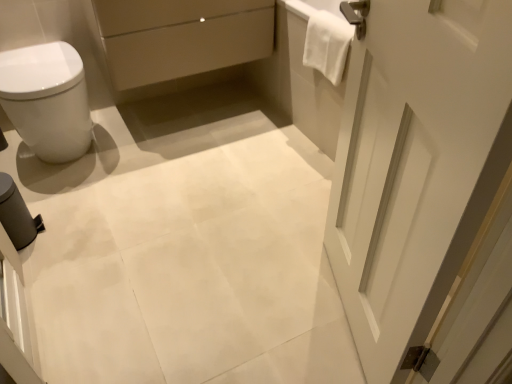
Measure the distance between point (392, 227) and camera.

36.69 inches.

Where is `matte beige drawer at upper center`? The height and width of the screenshot is (384, 512). matte beige drawer at upper center is located at coordinates (181, 37).

You are a GUI agent. You are given a task and a screenshot of the screen. Output one action in this format:
    pyautogui.click(x=<x>, y=<y>)
    Task: Click on the white matte door at right
    
    Given the screenshot: What is the action you would take?
    pyautogui.click(x=416, y=165)

From the image's perspective, would you say white towel at upper right is positioned over white glossy bidet at left?

Yes.

Considering the positions of points (330, 28) and (62, 113), is point (330, 28) farther from camera compared to point (62, 113)?

No, (330, 28) is closer to viewer.

Looking at this image, from the image's perspective, does matte beige drawer at upper center appear higher than white towel at upper right?

Yes.

Could you tell me if matte beige drawer at upper center is turned towards white towel at upper right?

Yes, matte beige drawer at upper center is oriented towards white towel at upper right.

Does point (258, 26) come behind point (337, 65)?

Yes, point (258, 26) is farther from viewer.

From a real-world perspective, between matte beige drawer at upper center and white towel at upper right, who is vertically lower?

matte beige drawer at upper center, from a real-world perspective.

Is matte beige drawer at upper center completely or partially inside white glossy bidet at left?

No, white glossy bidet at left does not contain matte beige drawer at upper center.

Visually, is white glossy bidet at left positioned to the left or to the right of matte beige drawer at upper center?

From the image, it's evident that white glossy bidet at left is to the left of matte beige drawer at upper center.

Measure the distance between white glossy bidet at left and matte beige drawer at upper center.

The distance of white glossy bidet at left from matte beige drawer at upper center is 15.46 inches.

Where is `bidet below the matte beige drawer at upper center (from a real-world perspective)`? This screenshot has height=384, width=512. bidet below the matte beige drawer at upper center (from a real-world perspective) is located at coordinates (47, 100).

From a real-world perspective, which is physically above, white matte door at right or white towel at upper right?

white matte door at right.

Can you confirm if white matte door at right is shorter than white towel at upper right?

No.

Which is in front, point (438, 116) or point (337, 33)?

Point (438, 116)

Between white matte door at right and white towel at upper right, which one has smaller width?

Thinner between the two is white towel at upper right.

How different are the orientations of white glossy bidet at left and white towel at upper right in degrees?

There is a 88.8-degree angle between the facing directions of white glossy bidet at left and white towel at upper right.

Which of these two, white glossy bidet at left or white towel at upper right, is thinner?

With smaller width is white towel at upper right.

Can you confirm if white glossy bidet at left is positioned to the right of white towel at upper right?

No, white glossy bidet at left is not to the right of white towel at upper right.

Which of these two, matte beige drawer at upper center or white glossy bidet at left, stands taller?

white glossy bidet at left is taller.

Considering the relative sizes of matte beige drawer at upper center and white glossy bidet at left in the image provided, is matte beige drawer at upper center bigger than white glossy bidet at left?

Yes, matte beige drawer at upper center is bigger than white glossy bidet at left.

Which object is wider, matte beige drawer at upper center or white glossy bidet at left?

With larger width is white glossy bidet at left.

Does point (120, 4) come in front of point (29, 114)?

Yes, it is in front of point (29, 114).

Which object is thinner, matte beige drawer at upper center or white matte door at right?

white matte door at right is thinner.

Considering the positions of point (246, 13) and point (380, 128), is point (246, 13) closer or farther from the camera than point (380, 128)?

Clearly, point (246, 13) is more distant from the camera than point (380, 128).

Considering the relative sizes of matte beige drawer at upper center and white matte door at right in the image provided, is matte beige drawer at upper center smaller than white matte door at right?

Actually, matte beige drawer at upper center might be larger than white matte door at right.

Can you tell me how much matte beige drawer at upper center and white matte door at right differ in facing direction?

They differ by 112 degrees in their facing directions.

Locate an element on the screen. bidet on the left of white towel at upper right is located at coordinates (47, 100).

Locate an element on the screen. This screenshot has width=512, height=384. drawer above the white towel at upper right (from the image's perspective) is located at coordinates (181, 37).

Looking at the image, which one is located closer to white glossy bidet at left, white towel at upper right or white matte door at right?

The object closer to white glossy bidet at left is white towel at upper right.

Which object lies nearer to the anchor point white glossy bidet at left, white towel at upper right or matte beige drawer at upper center?

Among the two, matte beige drawer at upper center is located nearer to white glossy bidet at left.

Which object lies nearer to the anchor point white matte door at right, matte beige drawer at upper center or white glossy bidet at left?

matte beige drawer at upper center lies closer to white matte door at right than the other object.

Consider the image. When comparing their distances from white towel at upper right, does white glossy bidet at left or matte beige drawer at upper center seem closer?

matte beige drawer at upper center lies closer to white towel at upper right than the other object.

When comparing their distances from white glossy bidet at left, does matte beige drawer at upper center or white towel at upper right seem further?

Among the two, white towel at upper right is located further to white glossy bidet at left.

Which object lies further to the anchor point white towel at upper right, matte beige drawer at upper center or white glossy bidet at left?

white glossy bidet at left lies further to white towel at upper right than the other object.

Considering their positions, is white matte door at right positioned closer to white towel at upper right than matte beige drawer at upper center?

matte beige drawer at upper center lies closer to white towel at upper right than the other object.

Considering their positions, is matte beige drawer at upper center positioned further to white towel at upper right than white matte door at right?

white matte door at right is positioned further to the anchor white towel at upper right.

This screenshot has width=512, height=384. Identify the location of material between white matte door at right and matte beige drawer at upper center along the z-axis. (327, 44).

Find the location of a particular element. This screenshot has width=512, height=384. door situated between white glossy bidet at left and white towel at upper right from left to right is located at coordinates (416, 165).

The height and width of the screenshot is (384, 512). I want to click on bidet between white matte door at right and matte beige drawer at upper center in the front-back direction, so click(x=47, y=100).

You are a GUI agent. You are given a task and a screenshot of the screen. Output one action in this format:
    pyautogui.click(x=<x>, y=<y>)
    Task: Click on the drawer between white glossy bidet at left and white towel at upper right in the horizontal direction
    
    Given the screenshot: What is the action you would take?
    pyautogui.click(x=181, y=37)